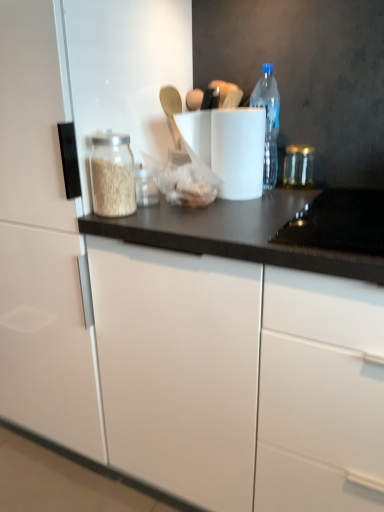
Question: Based on their sizes in the image, would you say white glossy cabinet at left is bigger or smaller than transparent glass jar at right?

Choices:
 (A) small
 (B) big

Answer: (B)

Question: Is white glossy cabinet at left inside or outside of transparent glass jar at right?

Choices:
 (A) inside
 (B) outside

Answer: (B)

Question: Estimate the real-world distances between objects in this image. Which object is farther from the white matte paper towel at center?

Choices:
 (A) white glossy cabinet at left
 (B) transparent glass jar at right
 (C) transparent plastic bottle at upper right

Answer: (A)

Question: Which object is the farthest from the white matte paper towel at center?

Choices:
 (A) transparent glass jar at right
 (B) transparent plastic bottle at upper right
 (C) white glossy cabinet at left

Answer: (C)